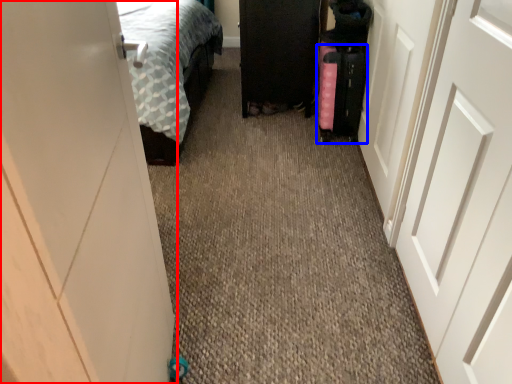
Question: Which object appears closest to the camera in this image, door (highlighted by a red box) or luggage (highlighted by a blue box)?

Choices:
 (A) door
 (B) luggage

Answer: (A)